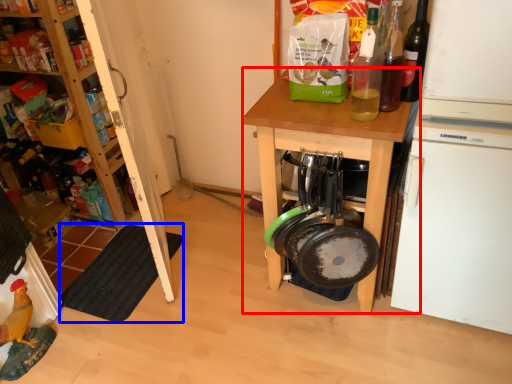
Question: Among these objects, which one is nearest to the camera, desk (highlighted by a red box) or mat (highlighted by a blue box)?

Choices:
 (A) desk
 (B) mat

Answer: (A)